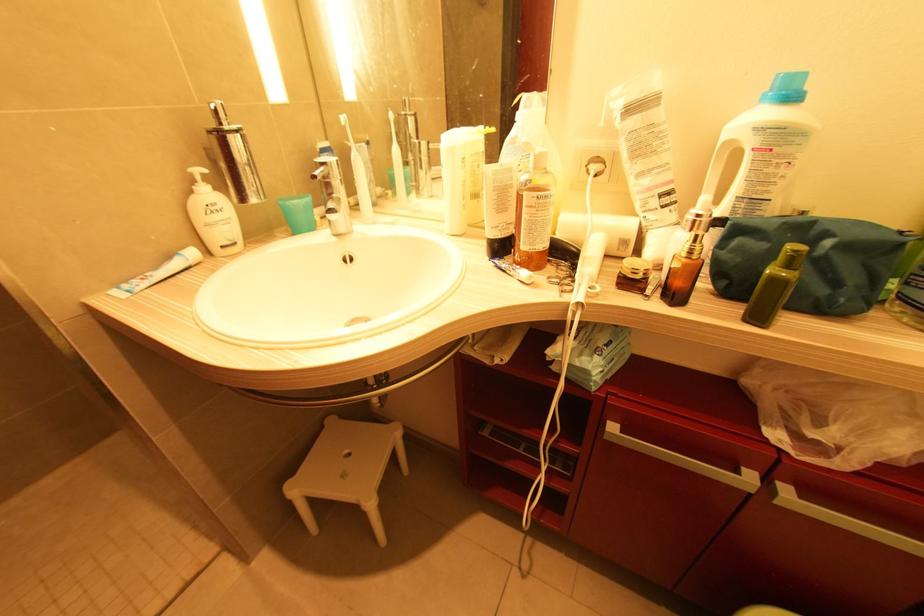
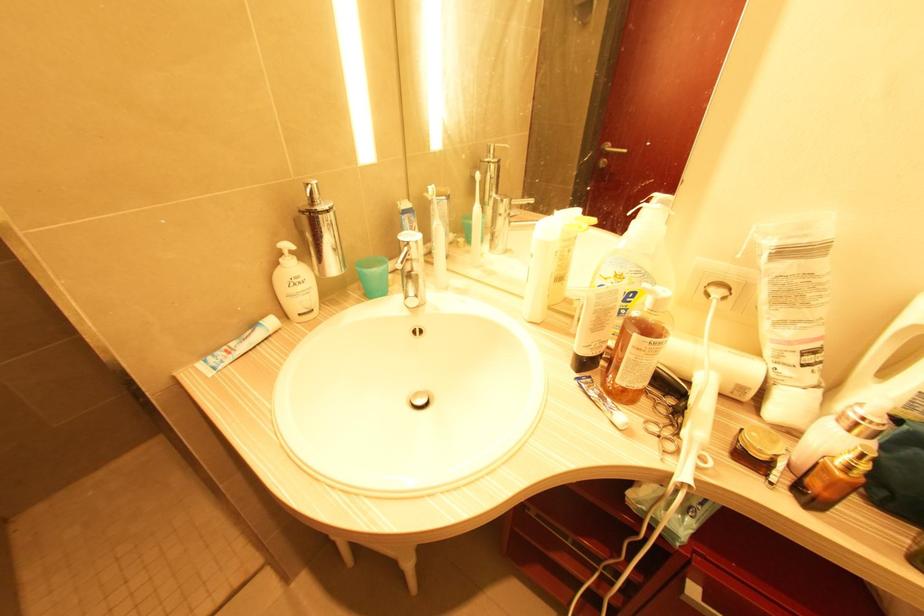
Find the pixel in the second image that matches [142,278] in the first image.

(226, 349)